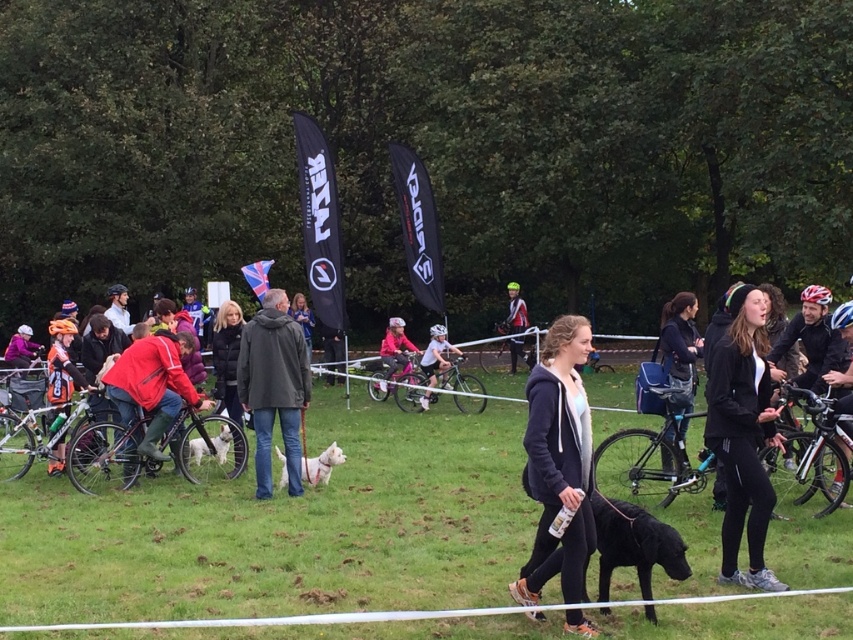
Question: Considering the real-world distances, which object is farthest from the black fur dog at center?

Choices:
 (A) dark gray jacket at center
 (B) dark blue hoodie at center
 (C) white fluffy dog at center

Answer: (A)

Question: Can you confirm if dark green jacket at center is bigger than dark gray jacket at center?

Choices:
 (A) yes
 (B) no

Answer: (A)

Question: Does black fur dog at center have a smaller size compared to black leather jacket at center?

Choices:
 (A) yes
 (B) no

Answer: (B)

Question: Is black matte jacket at center thinner than white fluffy dog at center?

Choices:
 (A) no
 (B) yes

Answer: (A)

Question: Which of the following is the closest to the observer?

Choices:
 (A) (558, 426)
 (B) (407, 365)
 (C) (311, 472)

Answer: (A)

Question: Among these objects, which one is farthest from the camera?

Choices:
 (A) dark green jacket at center
 (B) matte black helmet at center
 (C) pink fabric jacket at center
 (D) white matte helmet at center

Answer: (B)